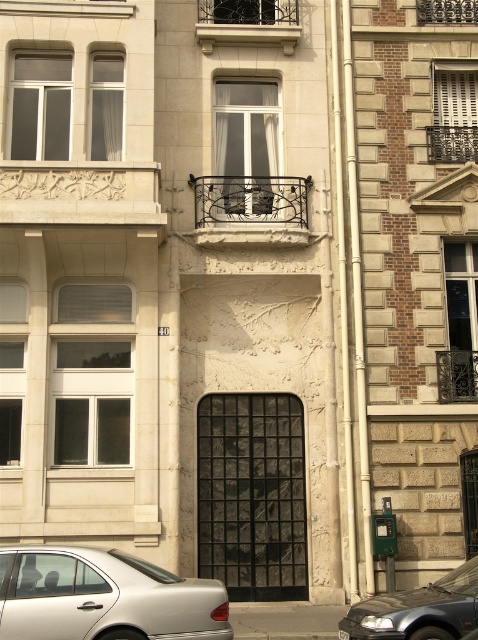
Question: Can you confirm if black wrought iron balcony at upper center is wider than green plastic parking meter at lower right?

Choices:
 (A) no
 (B) yes

Answer: (B)

Question: Which of the following is the closest to the observer?

Choices:
 (A) (391, 552)
 (B) (18, 620)

Answer: (B)

Question: Which object is positioned closest to the wrought iron balcony at center?

Choices:
 (A) green plastic parking meter at lower right
 (B) silver metallic car at lower left

Answer: (A)

Question: Is black wrought iron balcony at upper center closer to camera compared to green plastic parking meter at lower right?

Choices:
 (A) no
 (B) yes

Answer: (A)

Question: From the image, what is the correct spatial relationship of silver metallic car at lower left in relation to black wrought iron balcony at upper center?

Choices:
 (A) above
 (B) below

Answer: (B)

Question: Which object is the closest to the green plastic parking meter at lower right?

Choices:
 (A) black wrought iron balcony at upper center
 (B) wrought iron balcony at center
 (C) silver metallic car at lower left
 (D) silver metallic car at center

Answer: (D)